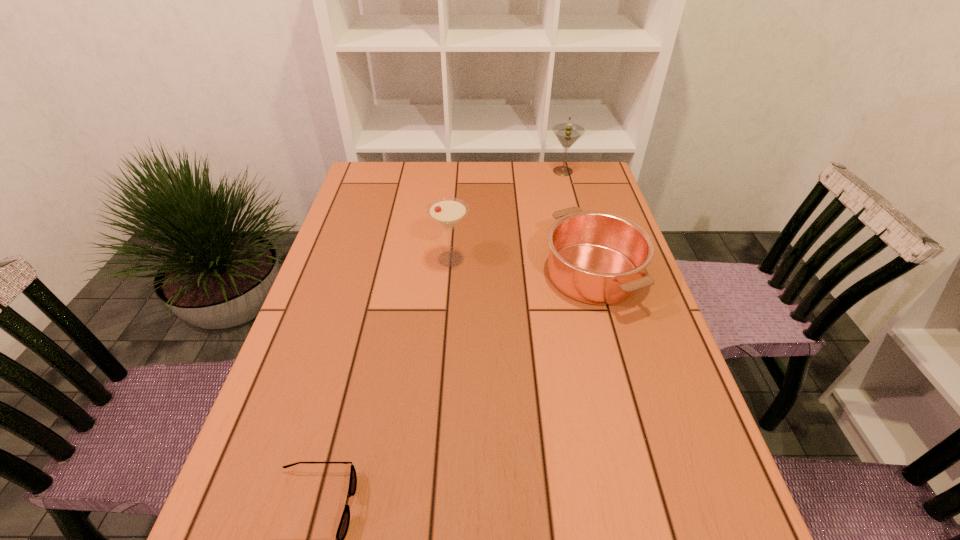
Where is `vacant space that satisfies the following two spatial constraints: 1. on the back side of the second object from left to right; 2. on the right side of the right martini`? This screenshot has height=540, width=960. vacant space that satisfies the following two spatial constraints: 1. on the back side of the second object from left to right; 2. on the right side of the right martini is located at coordinates (457, 171).